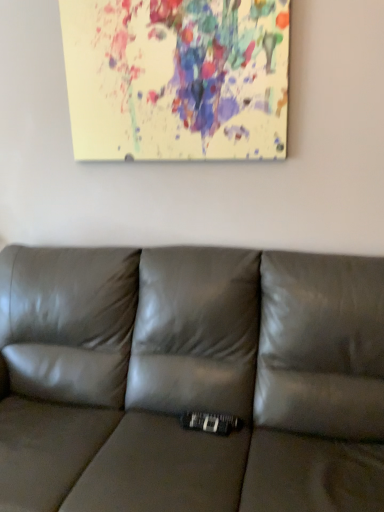
Question: Is satin gray leather couch at center positioned beyond the bounds of paint splatter canvas at upper center?

Choices:
 (A) no
 (B) yes

Answer: (B)

Question: From a real-world perspective, is satin gray leather couch at center located beneath paint splatter canvas at upper center?

Choices:
 (A) yes
 (B) no

Answer: (A)

Question: Is satin gray leather couch at center thinner than paint splatter canvas at upper center?

Choices:
 (A) yes
 (B) no

Answer: (B)

Question: Can you confirm if satin gray leather couch at center is bigger than paint splatter canvas at upper center?

Choices:
 (A) no
 (B) yes

Answer: (B)

Question: Is satin gray leather couch at center smaller than paint splatter canvas at upper center?

Choices:
 (A) yes
 (B) no

Answer: (B)

Question: Is satin gray leather couch at center further to the viewer compared to paint splatter canvas at upper center?

Choices:
 (A) no
 (B) yes

Answer: (A)

Question: Is paint splatter canvas at upper center not near satin gray leather couch at center?

Choices:
 (A) yes
 (B) no

Answer: (B)

Question: From a real-world perspective, does paint splatter canvas at upper center stand above satin gray leather couch at center?

Choices:
 (A) yes
 (B) no

Answer: (A)

Question: Can you confirm if paint splatter canvas at upper center is smaller than satin gray leather couch at center?

Choices:
 (A) no
 (B) yes

Answer: (B)

Question: Does paint splatter canvas at upper center have a lesser width compared to satin gray leather couch at center?

Choices:
 (A) no
 (B) yes

Answer: (B)

Question: Is paint splatter canvas at upper center outside satin gray leather couch at center?

Choices:
 (A) yes
 (B) no

Answer: (A)

Question: Is paint splatter canvas at upper center oriented towards satin gray leather couch at center?

Choices:
 (A) no
 (B) yes

Answer: (A)

Question: In the image, is paint splatter canvas at upper center positioned in front of or behind satin gray leather couch at center?

Choices:
 (A) front
 (B) behind

Answer: (B)